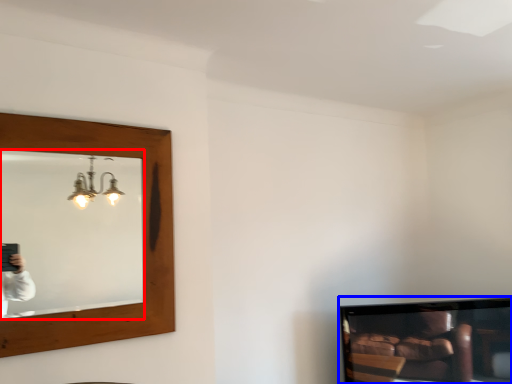
Question: Among these objects, which one is farthest to the camera, mirror (highlighted by a red box) or television (highlighted by a blue box)?

Choices:
 (A) mirror
 (B) television

Answer: (B)